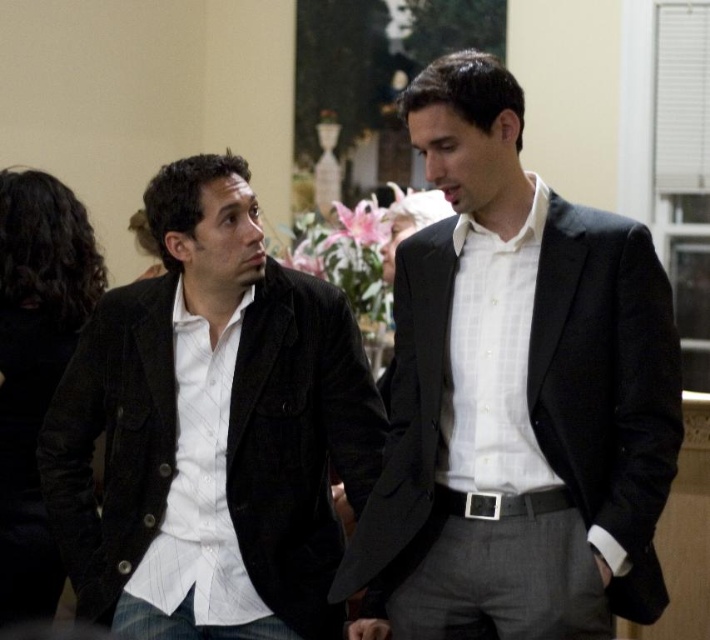
Question: Does matte black suit at center have a lesser width compared to matte black jacket at left?

Choices:
 (A) yes
 (B) no

Answer: (A)

Question: Does matte black suit at center have a larger size compared to matte black jacket at left?

Choices:
 (A) yes
 (B) no

Answer: (A)

Question: Among these objects, which one is nearest to the camera?

Choices:
 (A) matte black jacket at left
 (B) matte black suit at center

Answer: (B)

Question: Is the position of matte black suit at center more distant than that of matte black jacket at left?

Choices:
 (A) yes
 (B) no

Answer: (B)

Question: Which of the following is the closest to the observer?

Choices:
 (A) (207, 160)
 (B) (552, 538)

Answer: (B)

Question: Which of the following is the farthest from the observer?

Choices:
 (A) matte black suit at center
 (B) matte black jacket at left

Answer: (B)